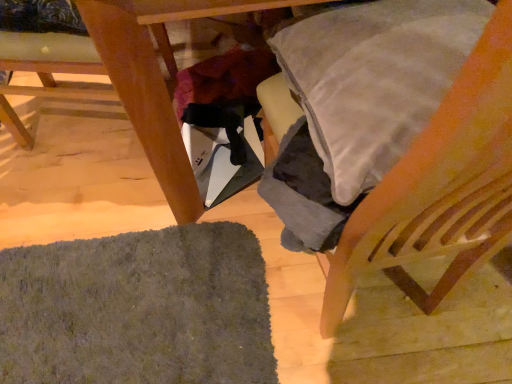
What are the coordinates of `blank space situated above dark gray shaggy mat at lower left (from a real-world perspective)` in the screenshot? It's located at (110, 312).